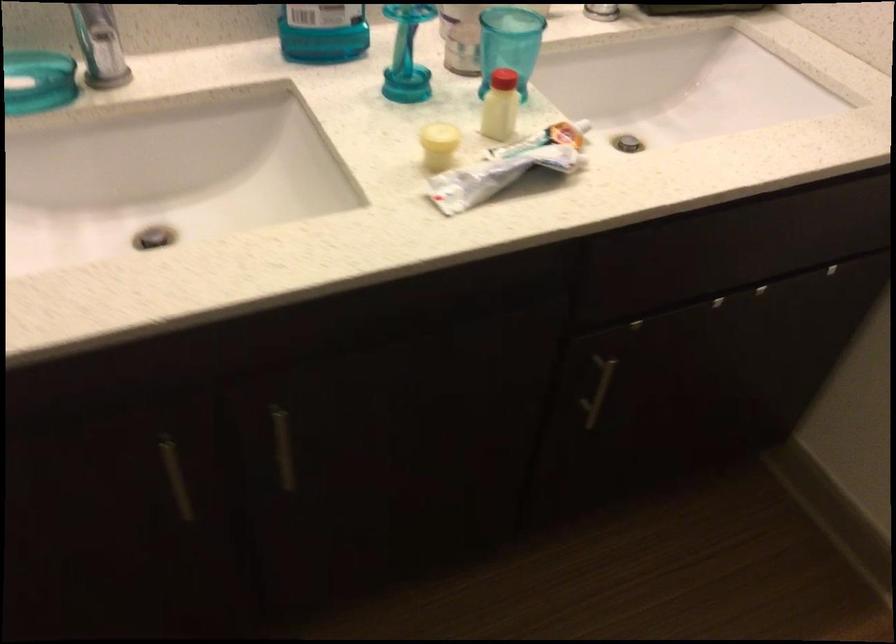
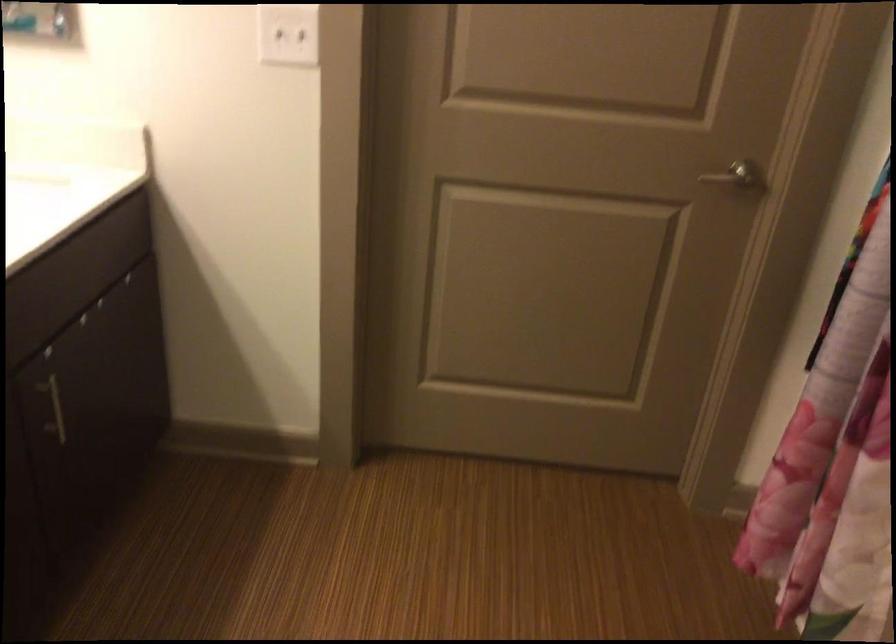
Find the pixel in the second image that matches [600,388] in the first image.

(54, 409)